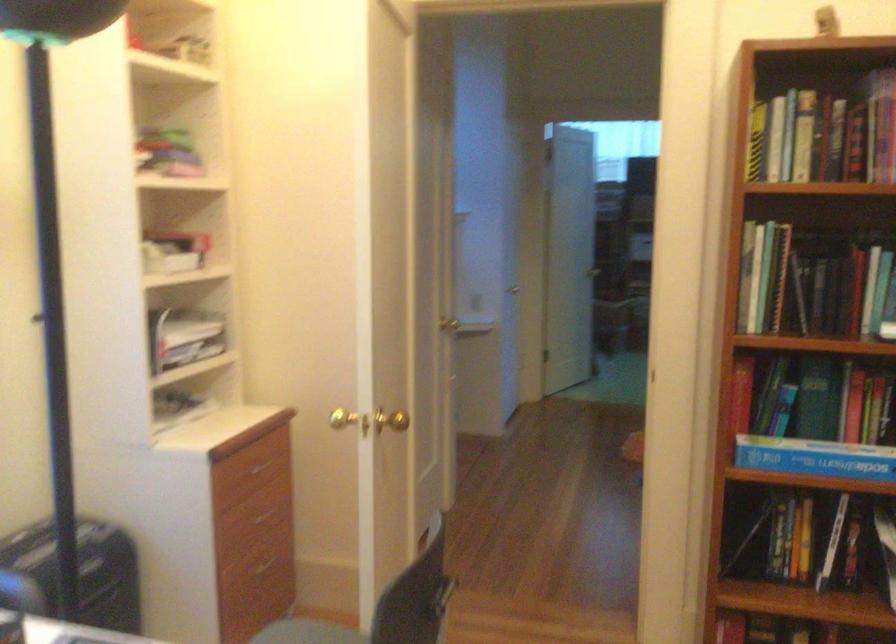
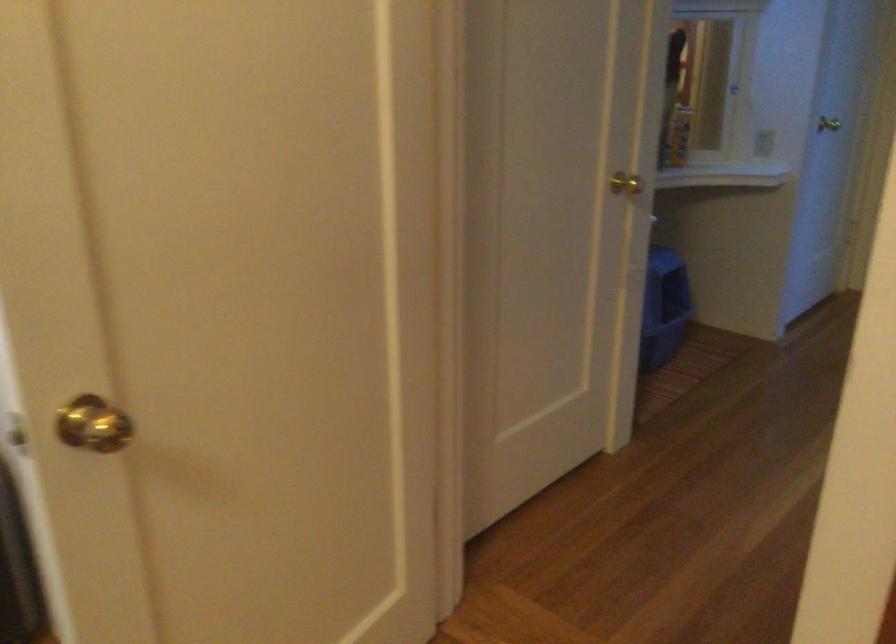
What movement of the cameraman would produce the second image?

The movement direction of the cameraman is right, forward.